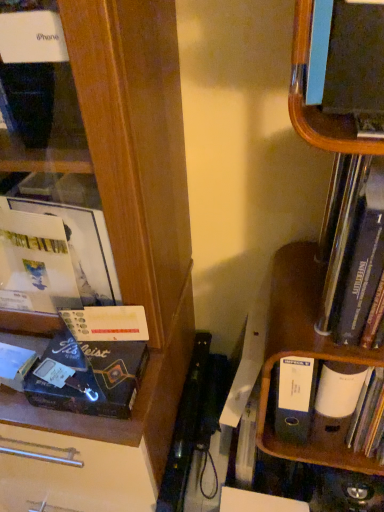
Question: Is point (365, 164) positioned closer to the camera than point (314, 433)?

Choices:
 (A) farther
 (B) closer

Answer: (B)

Question: From a real-world perspective, is hardcover book at right above or below blue cardboard file at lower right?

Choices:
 (A) below
 (B) above

Answer: (B)

Question: Which of these objects is positioned farthest from the matte black bookshelf at upper right, which is the second shelf in bottom-to-top order?

Choices:
 (A) black cardboard book at left
 (B) wooden bookshelf at right, the 1th shelf when ordered from bottom to top
 (C) hardcover book at right
 (D) blue cardboard file at lower right

Answer: (A)

Question: Which object is the farthest from the blue cardboard file at lower right?

Choices:
 (A) black cardboard book at left
 (B) wooden bookshelf at right, the 1th shelf when ordered from bottom to top
 (C) matte black bookshelf at upper right, which is the second shelf in bottom-to-top order
 (D) hardcover book at right

Answer: (C)